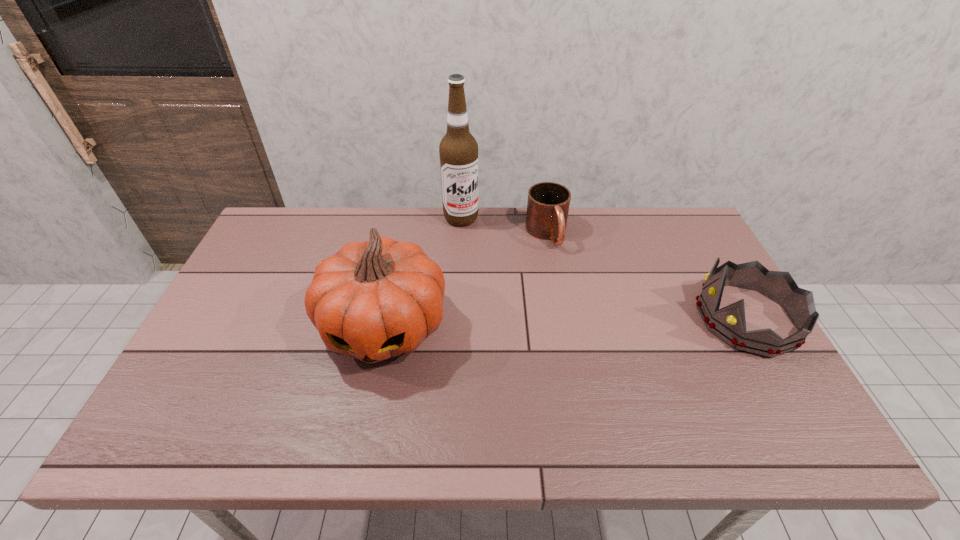
Identify the location of free space between the third object from left to right and the rightmost object. (646, 276).

Where is `free space between the tallest object and the mug`? The image size is (960, 540). free space between the tallest object and the mug is located at coordinates (504, 226).

You are a GUI agent. You are given a task and a screenshot of the screen. Output one action in this format:
    pyautogui.click(x=<x>, y=<y>)
    Task: Click on the free space between the alcohol and the second shortest object
    
    Given the screenshot: What is the action you would take?
    pyautogui.click(x=604, y=268)

Identify the location of free space between the tallest object and the tiara. (604, 268).

Where is `free space between the third shortest object and the rightmost object`? The width and height of the screenshot is (960, 540). free space between the third shortest object and the rightmost object is located at coordinates (565, 322).

Point out which object is positioned as the third nearest to the second tallest object. Please provide its 2D coordinates. Your answer should be formatted as a tuple, i.e. [(x, y)], where the tuple contains the x and y coordinates of a point satisfying the conditions above.

[(728, 323)]

Image resolution: width=960 pixels, height=540 pixels. What are the coordinates of `the second closest object relative to the shortest object` in the screenshot? It's located at (373, 300).

This screenshot has width=960, height=540. Identify the location of free space that satisfies the following two spatial constraints: 1. on the front side of the shortest object; 2. on the left side of the tallest object. (461, 234).

Locate an element on the screen. This screenshot has width=960, height=540. vacant point that satisfies the following two spatial constraints: 1. on the front side of the rightmost object; 2. at the front of the third object from left to right with jewels is located at coordinates (562, 319).

Locate an element on the screen. Image resolution: width=960 pixels, height=540 pixels. free space in the image that satisfies the following two spatial constraints: 1. on the front side of the rightmost object; 2. at the front of the tallest object with jewels is located at coordinates (456, 319).